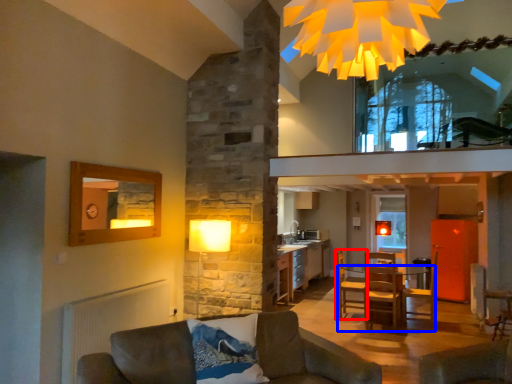
Question: Among these objects, which one is farthest to the camera, armchair (highlighted by a red box) or table (highlighted by a blue box)?

Choices:
 (A) armchair
 (B) table

Answer: (A)